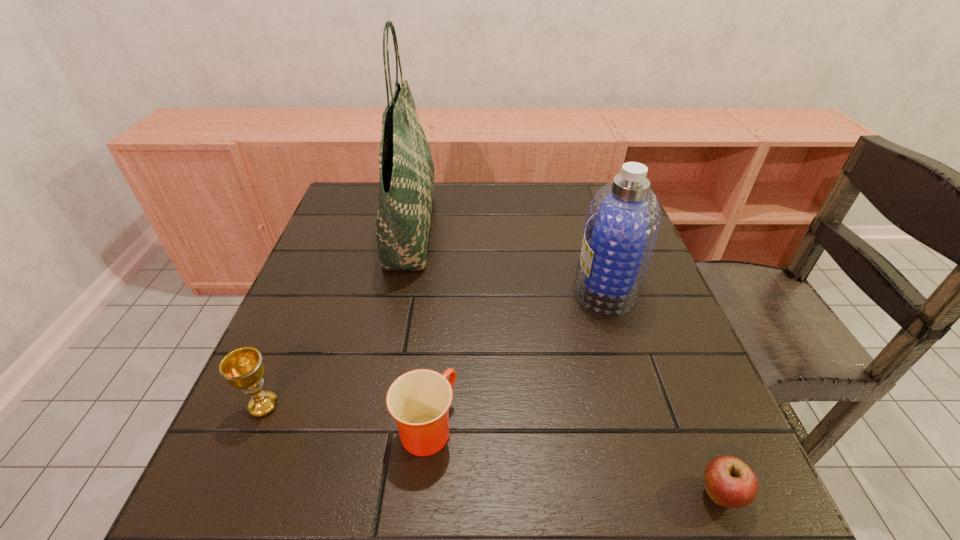
I want to click on vacant region located 0.250m on the back of the shortest object, so click(661, 347).

What are the coordinates of `object present at the far edge` in the screenshot? It's located at (406, 187).

Identify the location of object situated at the near edge. (729, 482).

You are a GUI agent. You are given a task and a screenshot of the screen. Output one action in this format:
    pyautogui.click(x=<x>, y=<y>)
    Task: Click on the tote bag that is positioned at the left edge
    Image resolution: width=960 pixels, height=540 pixels.
    Given the screenshot: What is the action you would take?
    pyautogui.click(x=406, y=187)

Image resolution: width=960 pixels, height=540 pixels. I want to click on chalice that is at the left edge, so click(243, 368).

The height and width of the screenshot is (540, 960). I want to click on cleansing agent that is at the right edge, so click(x=622, y=223).

Where is `apple present at the right edge`? The height and width of the screenshot is (540, 960). apple present at the right edge is located at coordinates (729, 482).

Find the location of a particular element. object that is positioned at the far left corner is located at coordinates click(x=406, y=187).

Where is `object located in the near right corner section of the desktop`? object located in the near right corner section of the desktop is located at coordinates (729, 482).

In the image, there is a desktop. Where is `vacant space at the far edge`? Image resolution: width=960 pixels, height=540 pixels. vacant space at the far edge is located at coordinates (501, 198).